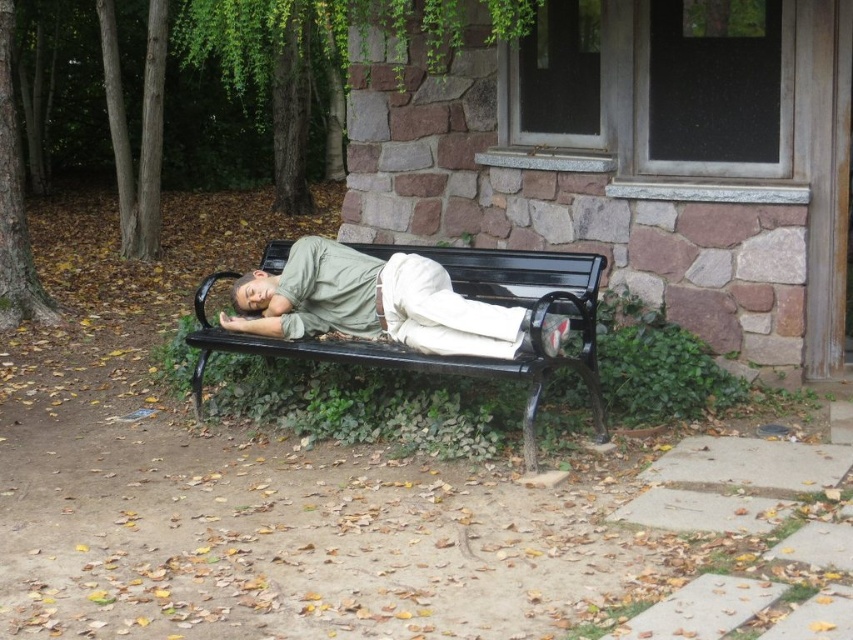
Question: Is green matte shirt at center bigger than black metal bench at center?

Choices:
 (A) yes
 (B) no

Answer: (B)

Question: Which object appears farthest from the camera in this image?

Choices:
 (A) green matte shirt at center
 (B) black metal bench at center

Answer: (A)

Question: Does green matte shirt at center have a larger size compared to black metal bench at center?

Choices:
 (A) yes
 (B) no

Answer: (B)

Question: Is green matte shirt at center positioned behind black metal bench at center?

Choices:
 (A) no
 (B) yes

Answer: (B)